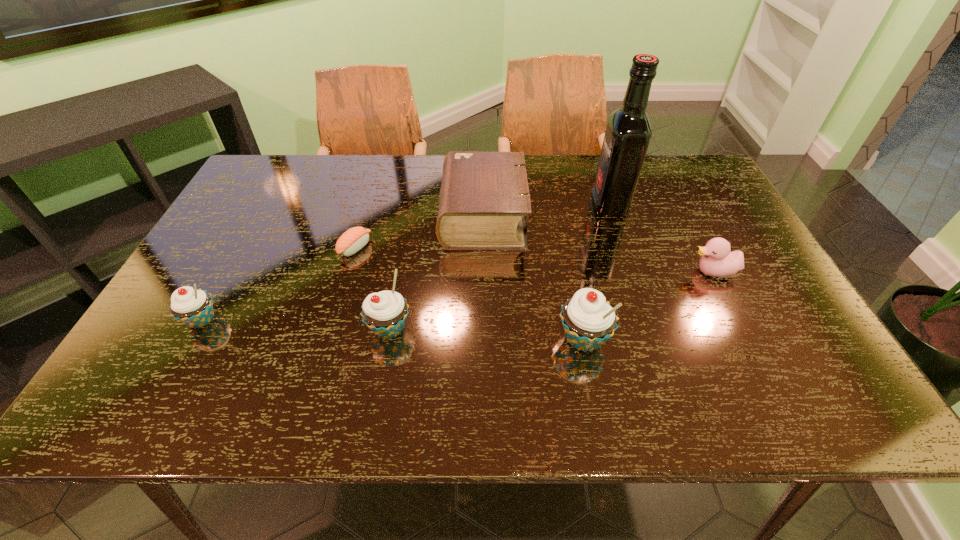
Where is `the leftmost object`? This screenshot has width=960, height=540. the leftmost object is located at coordinates (193, 307).

Where is `the leftmost cupcake`? Image resolution: width=960 pixels, height=540 pixels. the leftmost cupcake is located at coordinates (193, 307).

The width and height of the screenshot is (960, 540). What are the coordinates of `the third object from left to right` in the screenshot? It's located at (385, 312).

Locate an element on the screen. The height and width of the screenshot is (540, 960). the second cupcake from right to left is located at coordinates (385, 312).

Locate an element on the screen. The width and height of the screenshot is (960, 540). the rightmost cupcake is located at coordinates (588, 319).

The height and width of the screenshot is (540, 960). I want to click on the second object from right to left, so click(x=628, y=131).

At what (x,y) coordinates should I click in order to perform the action: click on the tallest object. Please return your answer as a coordinate pair (x, y). The width and height of the screenshot is (960, 540). Looking at the image, I should click on (628, 131).

Where is `Bible`? The image size is (960, 540). Bible is located at coordinates (484, 196).

Where is `the sixth object from right to left`? The image size is (960, 540). the sixth object from right to left is located at coordinates (354, 239).

I want to click on the shortest object, so click(x=354, y=239).